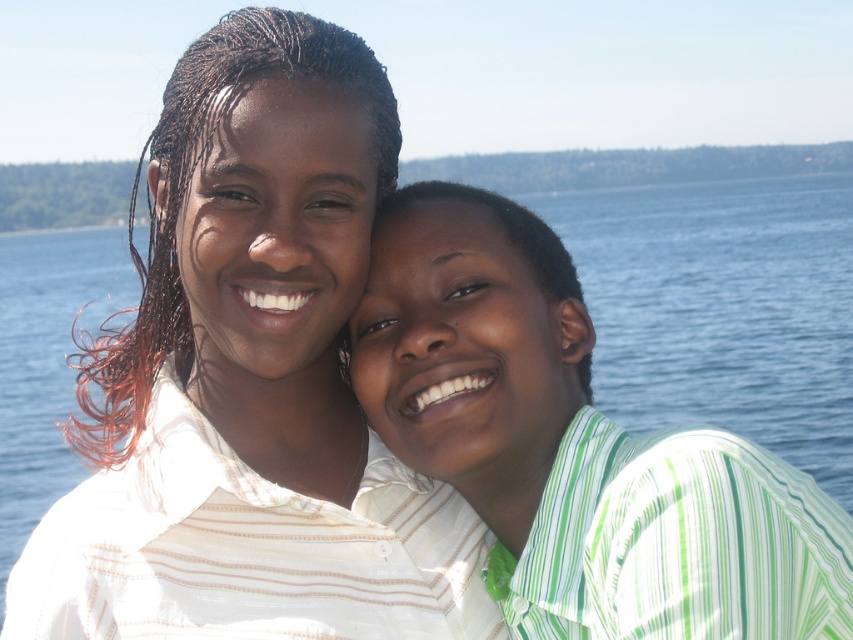
Please look at the image. There is a point at coordinates (x=251, y=381). Which object from the scene is exactly at that point?

The white striped shirt at center is located at point (x=251, y=381).

In the scene shown: You are a photographer standing at the edge of the water, aiming to capture a photo of both the white striped shirt at center and the green striped shirt at right. Your camera has a maximum focus range of 20 meters. Will both subjects be within the camera focus range?

The distance between the white striped shirt at center and the green striped shirt at right is 17.88 meters, which is within the camera focus range of 20 meters. Therefore, both subjects will be in focus.

You are a photographer trying to capture a group photo of the two people in the image. You want to ensure that both the white striped shirt at center and the green striped shirt at right are clearly visible in the frame. Given their sizes, which shirt should you focus on to ensure proper exposure?

The white striped shirt at center is larger than the green striped shirt at right, so focusing on the white striped shirt at center will ensure proper exposure since it occupies more space in the frame.